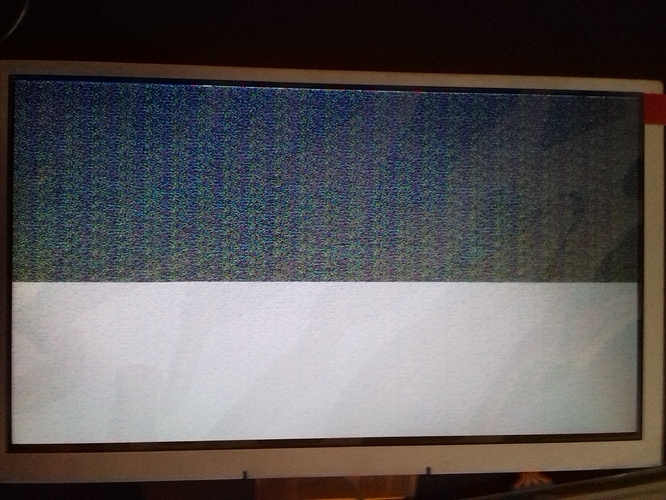
Where is `tv`? The height and width of the screenshot is (500, 666). tv is located at coordinates (377, 149).